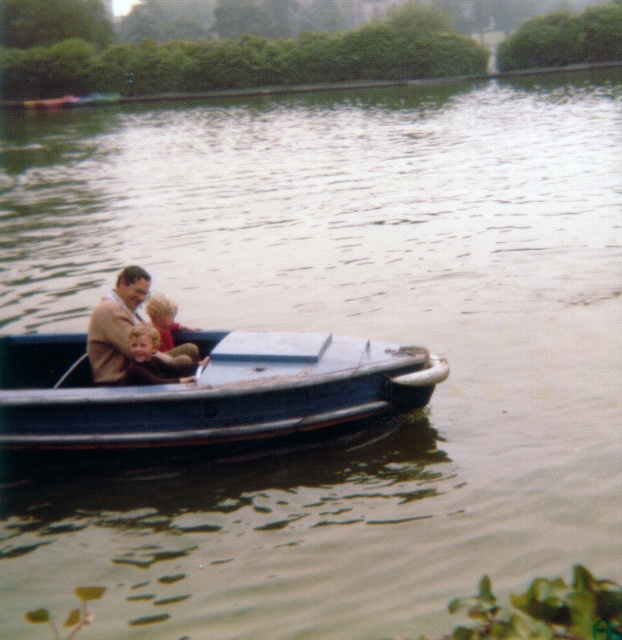
Is blue metallic boat at center positioned behind brown woolen suit at center?

No, it is not.

This screenshot has height=640, width=622. In order to click on blue metallic boat at center in this screenshot , I will do `click(207, 394)`.

This screenshot has height=640, width=622. Identify the location of blue metallic boat at center. [207, 394].